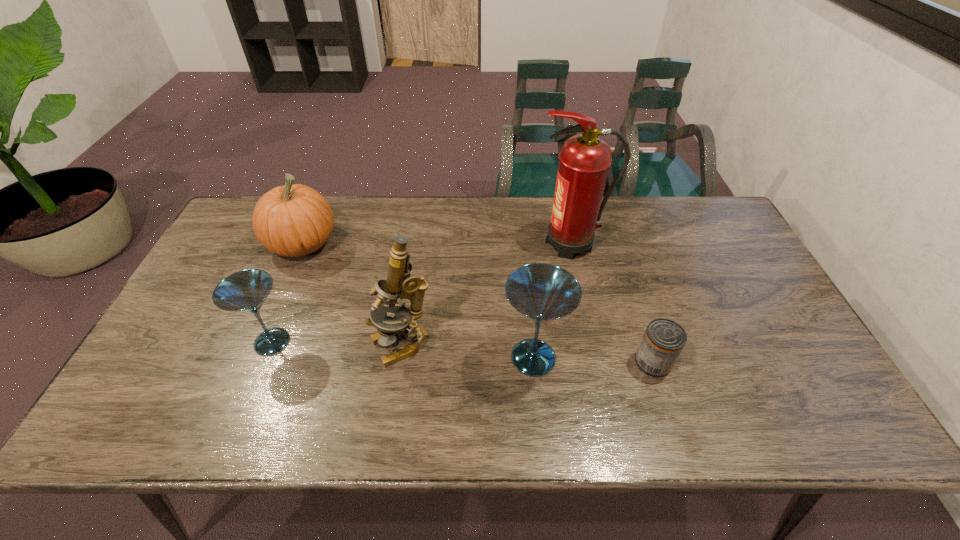
Locate an element on the screen. This screenshot has height=540, width=960. unoccupied position between the can and the right martini is located at coordinates (593, 360).

Image resolution: width=960 pixels, height=540 pixels. Identify the location of free space between the left martini and the pumpkin. (288, 293).

This screenshot has height=540, width=960. Identify the location of free space between the tallest object and the pumpkin. (438, 244).

Find the location of a particular element. vacant space that is in between the third object from left to right and the fire extinguisher is located at coordinates (487, 295).

I want to click on vacant area that lies between the left martini and the pumpkin, so click(288, 293).

You are a GUI agent. You are given a task and a screenshot of the screen. Output one action in this format:
    pyautogui.click(x=<x>, y=<y>)
    Task: Click on the fifth closest object to the shortest object
    The image size is (960, 540).
    Given the screenshot: What is the action you would take?
    pyautogui.click(x=295, y=220)

Select which object is the third closest to the taller martini. Please provide its 2D coordinates. Your answer should be formatted as a tuple, i.e. [(x, y)], where the tuple contains the x and y coordinates of a point satisfying the conditions above.

[(584, 160)]

At what (x,y) coordinates should I click in order to perform the action: click on free point that satisfies the following two spatial constraints: 1. on the back side of the fourth object from right to left; 2. on the stem of the pumpkin. Please return your answer as a coordinate pair (x, y). The height and width of the screenshot is (540, 960). Looking at the image, I should click on (417, 244).

What are the coordinates of `free space that satisfies the following two spatial constraints: 1. on the front side of the second shortest object; 2. on the right side of the right martini` in the screenshot? It's located at (266, 357).